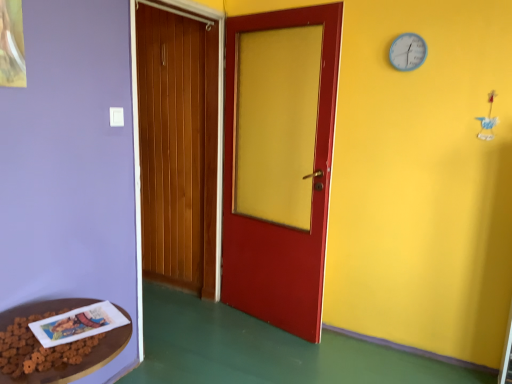
Question: From the image's perspective, would you say brown wooden table at lower left is shown under blue plastic clock at upper right?

Choices:
 (A) yes
 (B) no

Answer: (A)

Question: Is brown wooden table at lower left in front of blue plastic clock at upper right?

Choices:
 (A) no
 (B) yes

Answer: (B)

Question: From the image's perspective, does brown wooden table at lower left appear higher than blue plastic clock at upper right?

Choices:
 (A) yes
 (B) no

Answer: (B)

Question: Are brown wooden table at lower left and blue plastic clock at upper right located far from each other?

Choices:
 (A) yes
 (B) no

Answer: (A)

Question: Is brown wooden table at lower left not inside blue plastic clock at upper right?

Choices:
 (A) yes
 (B) no

Answer: (A)

Question: Considering the relative positions of brown wooden table at lower left and blue plastic clock at upper right in the image provided, is brown wooden table at lower left to the right of blue plastic clock at upper right from the viewer's perspective?

Choices:
 (A) no
 (B) yes

Answer: (A)

Question: Is blue plastic clock at upper right wider than white paper book at lower left?

Choices:
 (A) yes
 (B) no

Answer: (B)

Question: Is blue plastic clock at upper right directly adjacent to white paper book at lower left?

Choices:
 (A) yes
 (B) no

Answer: (B)

Question: Considering the relative sizes of blue plastic clock at upper right and white paper book at lower left in the image provided, is blue plastic clock at upper right thinner than white paper book at lower left?

Choices:
 (A) no
 (B) yes

Answer: (B)

Question: Is blue plastic clock at upper right positioned before white paper book at lower left?

Choices:
 (A) yes
 (B) no

Answer: (B)

Question: From the image's perspective, would you say blue plastic clock at upper right is positioned over white paper book at lower left?

Choices:
 (A) yes
 (B) no

Answer: (A)

Question: From a real-world perspective, is blue plastic clock at upper right over white paper book at lower left?

Choices:
 (A) yes
 (B) no

Answer: (A)

Question: Is blue plastic clock at upper right to the right of brown wooden table at lower left from the viewer's perspective?

Choices:
 (A) no
 (B) yes

Answer: (B)